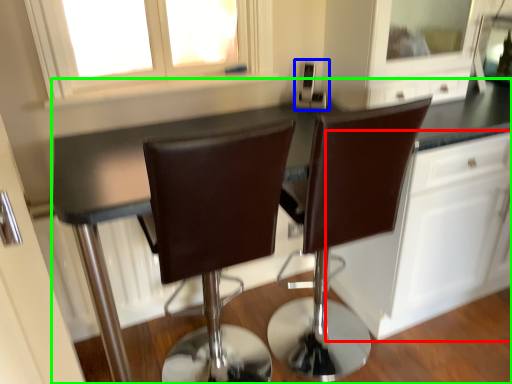
Question: Which object is the farthest from cabinetry (highlighted by a red box)? Choose among these: appliance (highlighted by a blue box) or countertop (highlighted by a green box).

Choices:
 (A) appliance
 (B) countertop

Answer: (A)